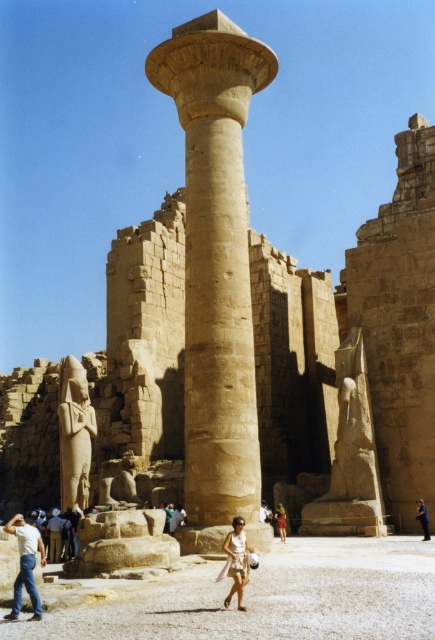
Question: Which is nearer to the light brown stone statue at lower left?

Choices:
 (A) blue denim jeans at lower center
 (B) denim jeans at lower left
 (C) tan fabric shorts at center
 (D) beige stone column at center

Answer: (B)

Question: Can you confirm if light brown stone statue at center is bigger than light brown fabric dress at center?

Choices:
 (A) no
 (B) yes

Answer: (B)

Question: Which object appears farthest from the camera in this image?

Choices:
 (A) beige stone column at center
 (B) light brown fabric dress at center
 (C) blue denim jeans at lower center
 (D) white cotton shirt at center

Answer: (B)

Question: Does beige stone column at center have a larger size compared to tan fabric shorts at center?

Choices:
 (A) yes
 (B) no

Answer: (A)

Question: Which of the following is the farthest from the observer?

Choices:
 (A) tan fabric shorts at center
 (B) light brown stone statue at center
 (C) beige stone column at center

Answer: (B)

Question: Can you confirm if denim jeans at lower left is positioned above light brown stone statue at center?

Choices:
 (A) no
 (B) yes

Answer: (A)